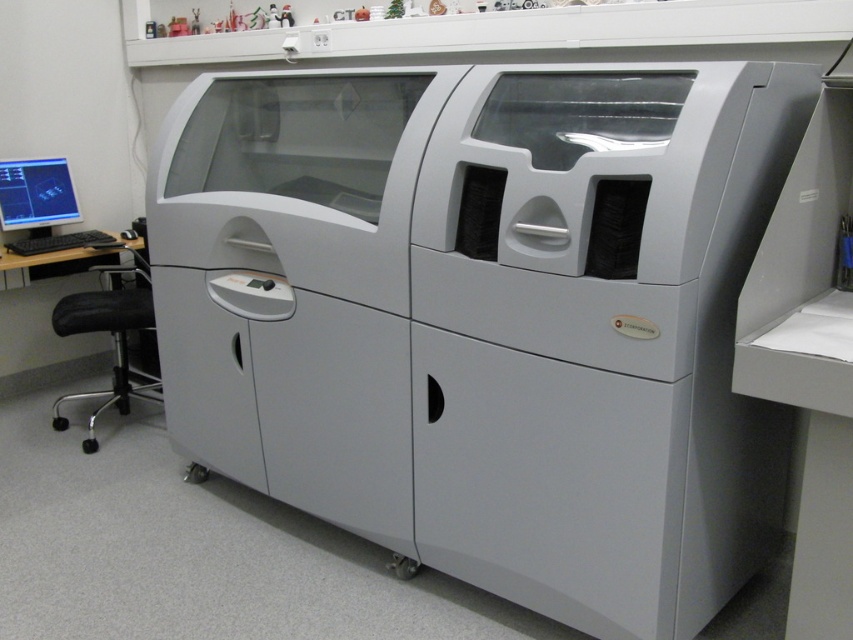
Question: Which object is closer to the camera taking this photo?

Choices:
 (A) black plastic computer desk at lower left
 (B) matte black monitor at left
 (C) matte gray printer at center

Answer: (C)

Question: Is black plastic computer desk at lower left further to the viewer compared to matte black monitor at left?

Choices:
 (A) no
 (B) yes

Answer: (A)

Question: Which object appears farthest from the camera in this image?

Choices:
 (A) matte black monitor at left
 (B) black plastic computer desk at lower left
 (C) matte gray printer at center

Answer: (A)

Question: In this image, where is matte gray printer at center located relative to black plastic computer desk at lower left?

Choices:
 (A) below
 (B) above

Answer: (A)

Question: Which point is closer to the camera?

Choices:
 (A) (24, 161)
 (B) (9, 260)
 (C) (321, 128)

Answer: (C)

Question: In this image, where is black plastic computer desk at lower left located relative to matte black monitor at left?

Choices:
 (A) above
 (B) below

Answer: (B)